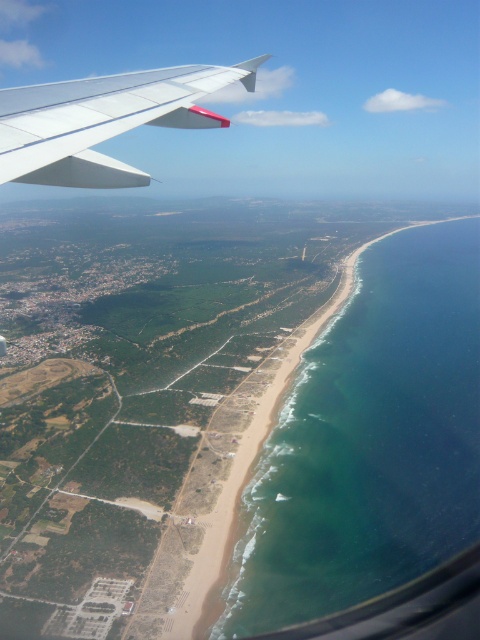
You are a pilot observing the coastal landscape from the airplane window. You notice the green water at beach right. Can you determine its location relative to the airplane wing in the upper left corner?

The green water at beach right is located at point (369,442) in the image frame, which is to the lower right of the airplane wing in the upper left corner.

You are a pilot observing the scene from the cockpit. You notice the green water at beach right and the white matte wing at upper left. Which object is positioned higher in the image?

The white matte wing at upper left is higher because the green water at beach right is not as tall as it.